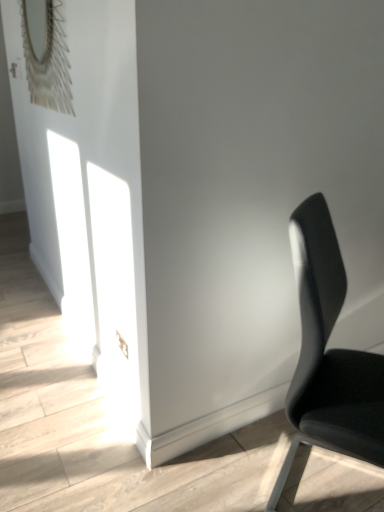
Question: Can you confirm if matte silver mirror at upper left is smaller than black leather chair at right?

Choices:
 (A) yes
 (B) no

Answer: (A)

Question: Considering the relative positions of matte silver mirror at upper left and black leather chair at right in the image provided, is matte silver mirror at upper left to the right of black leather chair at right from the viewer's perspective?

Choices:
 (A) no
 (B) yes

Answer: (A)

Question: Considering the relative sizes of matte silver mirror at upper left and black leather chair at right in the image provided, is matte silver mirror at upper left shorter than black leather chair at right?

Choices:
 (A) no
 (B) yes

Answer: (B)

Question: Is the position of matte silver mirror at upper left more distant than that of black leather chair at right?

Choices:
 (A) yes
 (B) no

Answer: (A)

Question: Does matte silver mirror at upper left appear on the left side of black leather chair at right?

Choices:
 (A) no
 (B) yes

Answer: (B)

Question: From the image's perspective, does matte silver mirror at upper left appear higher than black leather chair at right?

Choices:
 (A) yes
 (B) no

Answer: (A)

Question: From the image's perspective, is black leather chair at right below matte silver mirror at upper left?

Choices:
 (A) yes
 (B) no

Answer: (A)

Question: Is black leather chair at right not within matte silver mirror at upper left?

Choices:
 (A) yes
 (B) no

Answer: (A)

Question: Considering the relative sizes of black leather chair at right and matte silver mirror at upper left in the image provided, is black leather chair at right shorter than matte silver mirror at upper left?

Choices:
 (A) yes
 (B) no

Answer: (B)

Question: Could you tell me if black leather chair at right is facing matte silver mirror at upper left?

Choices:
 (A) yes
 (B) no

Answer: (B)

Question: Is black leather chair at right positioned far away from matte silver mirror at upper left?

Choices:
 (A) no
 (B) yes

Answer: (B)

Question: Is black leather chair at right at the left side of matte silver mirror at upper left?

Choices:
 (A) no
 (B) yes

Answer: (A)

Question: From a real-world perspective, relative to matte silver mirror at upper left, is black leather chair at right vertically above or below?

Choices:
 (A) above
 (B) below

Answer: (B)